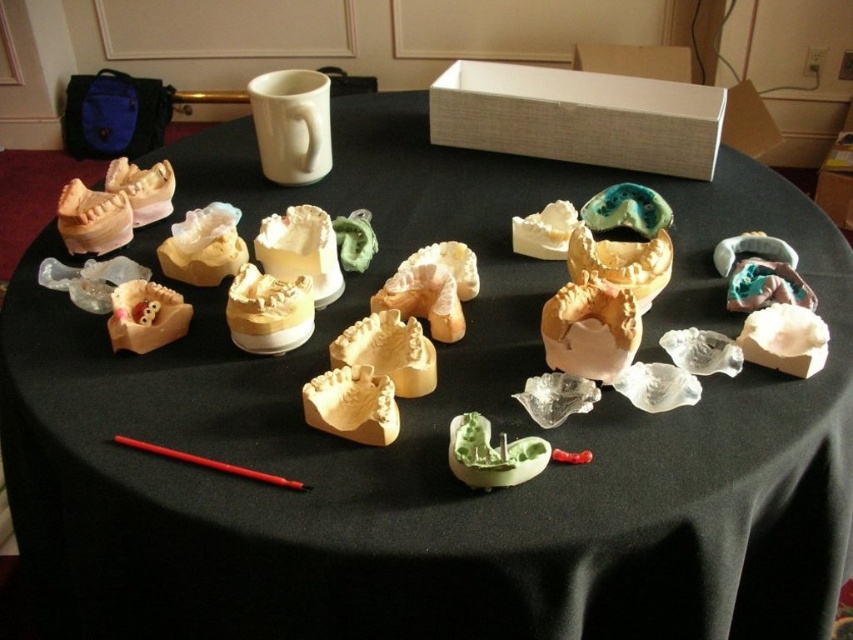
This screenshot has width=853, height=640. Identify the location of matte white plaster cast at center. (590, 328).

Which is in front, point (573, 326) or point (370, 380)?

Point (370, 380)

This screenshot has height=640, width=853. Find the location of `matte white plaster cast at center`. matte white plaster cast at center is located at coordinates (590, 328).

Between matte yellow dental mold at center and green matte mold at center, which one is positioned higher?

matte yellow dental mold at center

Does point (363, 413) come closer to viewer compared to point (469, 420)?

No, (363, 413) is further to viewer.

This screenshot has width=853, height=640. Identify the location of matte yellow dental mold at center. (352, 404).

Between matte white plaster cast at center and green matte mold at center, which one has more height?

With more height is matte white plaster cast at center.

At what (x,y) coordinates should I click in order to perform the action: click on matte white plaster cast at center. Please return your answer as a coordinate pair (x, y). This screenshot has width=853, height=640. Looking at the image, I should click on (x=590, y=328).